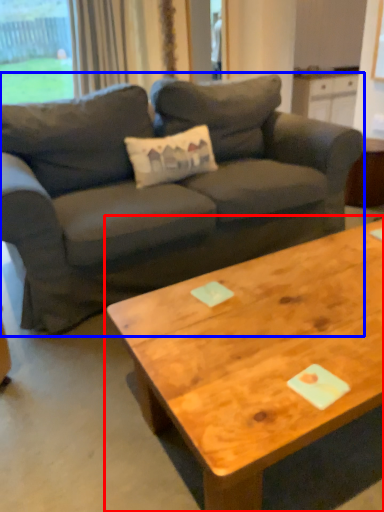
Question: Which object is further to the camera taking this photo, coffee table (highlighted by a red box) or studio couch (highlighted by a blue box)?

Choices:
 (A) coffee table
 (B) studio couch

Answer: (B)